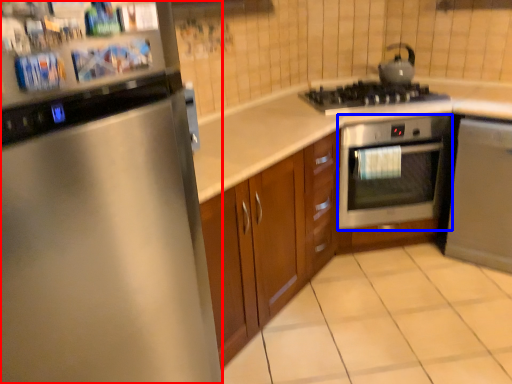
Question: Which point is further to the camera, home appliance (highlighted by a red box) or oven (highlighted by a blue box)?

Choices:
 (A) home appliance
 (B) oven

Answer: (B)